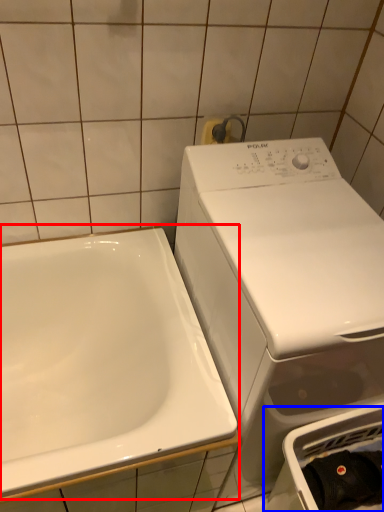
Question: Which object appears farthest to the camera in this image, sink (highlighted by a red box) or dish washer (highlighted by a blue box)?

Choices:
 (A) sink
 (B) dish washer

Answer: (B)